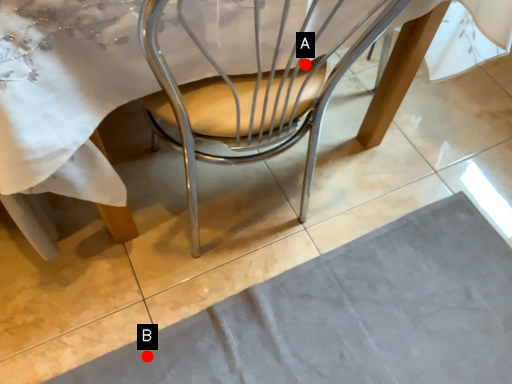
Question: Two points are circled on the image, labeled by A and B beside each circle. Which point is closer to the camera taking this photo?

Choices:
 (A) A is closer
 (B) B is closer

Answer: (A)